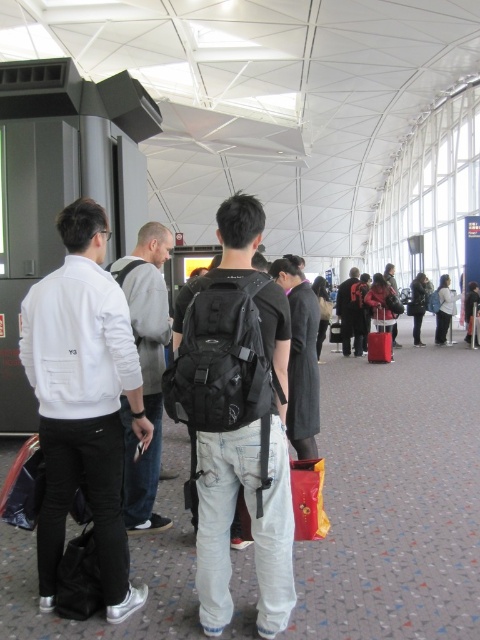
You are an airport staff member and need to locate two items in the scene. There is a matte black backpack at center and a dark gray suit at center. Which one is positioned to the right side?

The dark gray suit at center is positioned to the right of the matte black backpack at center.

From the picture: You are an airport staff member checking the positions of passengers. You see the white matte jacket at left and the matte black backpack at center. Which passenger is closer to the floor?

The white matte jacket at left is closer to the floor because it is below the matte black backpack at center.